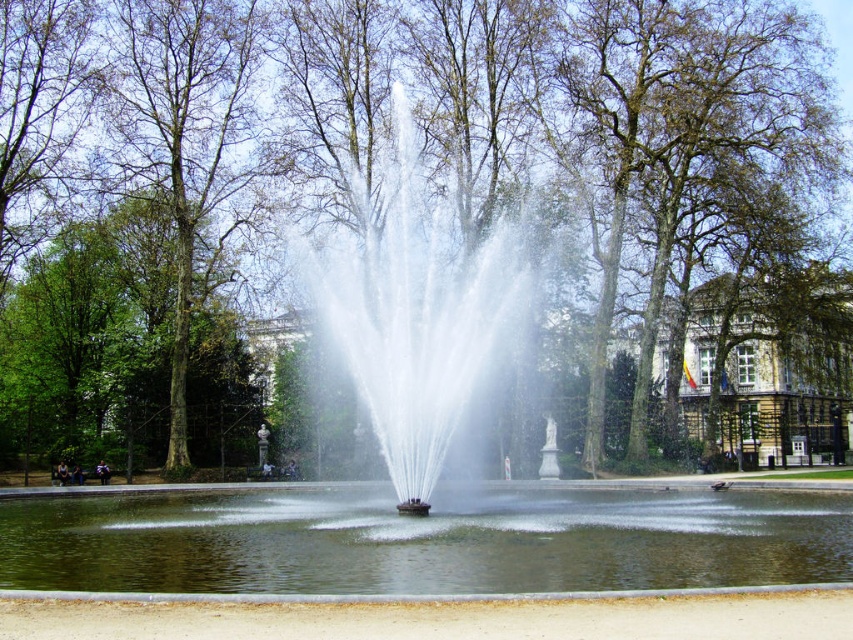
You are standing on the paved area near the fountain and want to walk to the brown stone building at center. Which direction should you move relative to the clear water at center?

You should move to the right relative to the clear water at center because the brown stone building at center is positioned on the right side of the clear water at center.

You are standing at the fountain in the park and want to walk to the point labeled point (416, 157) and point (682, 336). Which point will you reach first if you walk directly towards them?

You will reach point (416, 157) first because it is closer to you than point (682, 336).